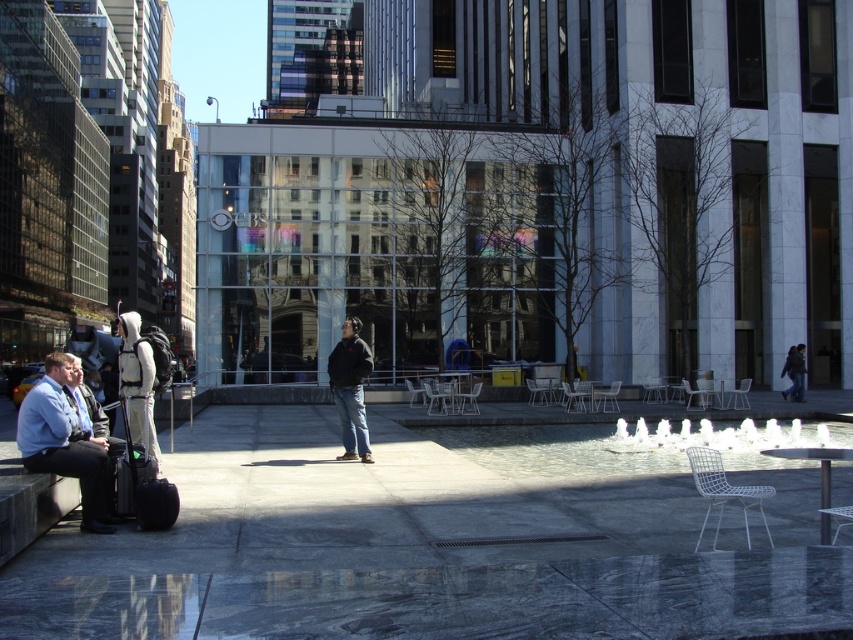
You are a photographer standing in the plaza and want to capture both the light blue shirt at lower left and the black matte suitcase at lower left in your photo. Which object will appear bigger in the final photo?

The light blue shirt at lower left will appear bigger in the final photo because it is larger in size than the black matte suitcase at lower left.

You are standing at the center of the plaza and want to reach the white frothy water at lower right without getting too close to the light blue shirt at lower left. What is the minimum distance you need to walk from your current position?

The light blue shirt at lower left is 12.06 meters away from the white frothy water at lower right. To avoid getting too close to the light blue shirt at lower left, you should walk around it, but the shortest path directly to the white frothy water at lower right is 12.06 meters.

From the picture: You are standing at the fountain in the plaza and see two points marked on the ground. One is at point (51, 408) and the other at point (721, 440). Which point is closer to you?

Point (51, 408) is in front of point (721, 440), so it is closer to you.